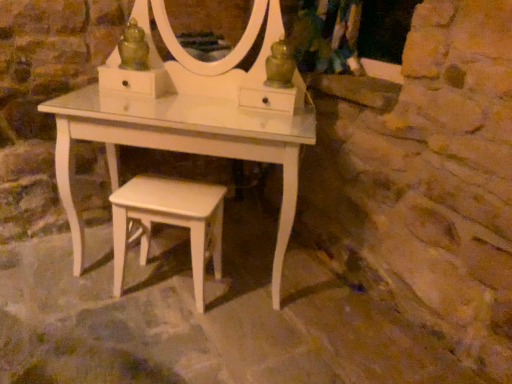
Where is `vacant area in front of white matte stool at center`? Image resolution: width=512 pixels, height=384 pixels. vacant area in front of white matte stool at center is located at coordinates (182, 334).